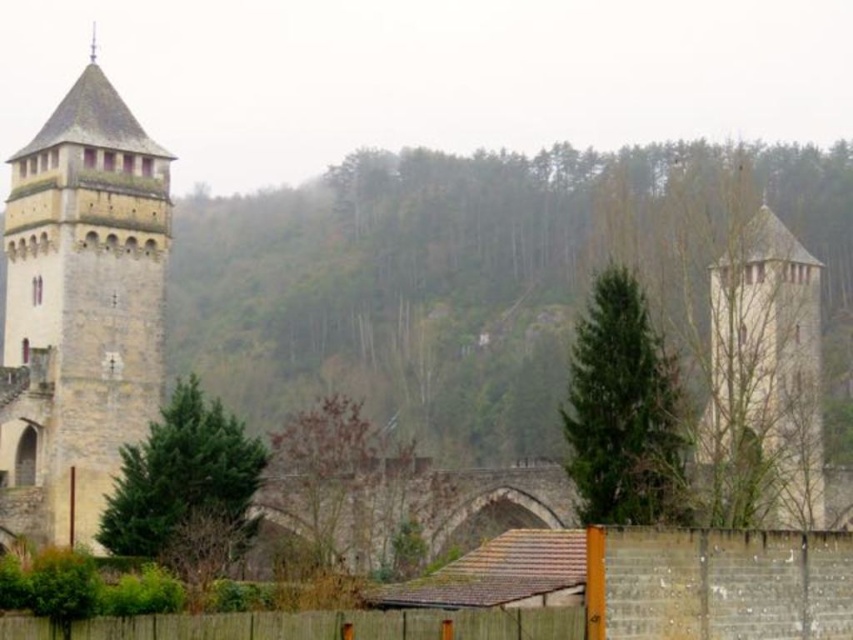
Is brown wooden fence at lower center taller than light beige stone tower at right?

No, brown wooden fence at lower center is not taller than light beige stone tower at right.

Can you confirm if brown wooden fence at lower center is thinner than light beige stone tower at right?

No.

Is point (718, 552) farther from camera compared to point (805, 356)?

No, (718, 552) is closer to viewer.

Where is `brown wooden fence at lower center`? brown wooden fence at lower center is located at coordinates (577, 605).

Does stone tower at left have a lesser width compared to brown wooden fence at lower center?

Yes, stone tower at left is thinner than brown wooden fence at lower center.

The width and height of the screenshot is (853, 640). Describe the element at coordinates (79, 308) in the screenshot. I see `stone tower at left` at that location.

What do you see at coordinates (79, 308) in the screenshot? This screenshot has width=853, height=640. I see `stone tower at left` at bounding box center [79, 308].

This screenshot has height=640, width=853. I want to click on stone tower at left, so click(79, 308).

Can you confirm if stone tower at left is positioned to the left of light beige stone tower at right?

Indeed, stone tower at left is positioned on the left side of light beige stone tower at right.

Is stone tower at left shorter than light beige stone tower at right?

No.

This screenshot has height=640, width=853. I want to click on stone tower at left, so click(x=79, y=308).